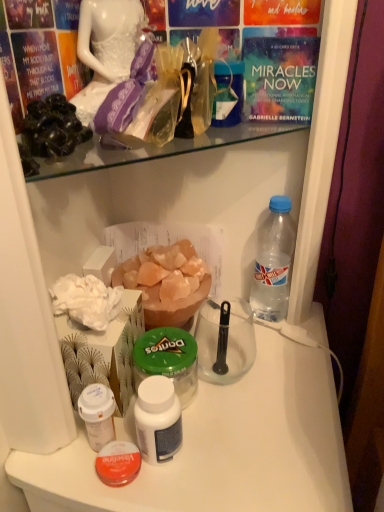
Question: From the image's perspective, is white plastic cup at lower left, arranged as the 4th bottle when viewed from the right, on black matte rock at upper left?

Choices:
 (A) no
 (B) yes

Answer: (A)

Question: Would you say white plastic cup at lower left, the first bottle when ordered from left to right, contains black matte rock at upper left?

Choices:
 (A) yes
 (B) no

Answer: (B)

Question: Is white plastic cup at lower left, arranged as the 4th bottle when viewed from the right, behind black matte rock at upper left?

Choices:
 (A) yes
 (B) no

Answer: (A)

Question: Is the depth of white plastic cup at lower left, arranged as the 4th bottle when viewed from the right, less than that of black matte rock at upper left?

Choices:
 (A) yes
 (B) no

Answer: (B)

Question: Could you tell me if white plastic cup at lower left, the first bottle when ordered from left to right, is turned towards black matte rock at upper left?

Choices:
 (A) yes
 (B) no

Answer: (B)

Question: Is white plastic cup at lower left, the first bottle when ordered from left to right, far away from black matte rock at upper left?

Choices:
 (A) yes
 (B) no

Answer: (B)

Question: Is clear plastic bottle at right, the first bottle when ordered from right to left, at the back of white plastic bottle at center, the 3th bottle positioned from the right?

Choices:
 (A) no
 (B) yes

Answer: (A)

Question: From a real-world perspective, does white plastic bottle at center, the 3th bottle positioned from the right, stand above clear plastic bottle at right, the first bottle when ordered from right to left?

Choices:
 (A) no
 (B) yes

Answer: (A)

Question: Is white plastic bottle at center, which is the second bottle from left to right, completely or partially outside of clear plastic bottle at right, which ranks as the 4th bottle in left-to-right order?

Choices:
 (A) yes
 (B) no

Answer: (A)

Question: Is white plastic bottle at center, which is the second bottle from left to right, in contact with clear plastic bottle at right, which ranks as the 4th bottle in left-to-right order?

Choices:
 (A) yes
 (B) no

Answer: (B)

Question: Considering the relative sizes of white plastic bottle at center, which is the second bottle from left to right, and clear plastic bottle at right, the first bottle when ordered from right to left, in the image provided, is white plastic bottle at center, which is the second bottle from left to right, thinner than clear plastic bottle at right, the first bottle when ordered from right to left,?

Choices:
 (A) yes
 (B) no

Answer: (A)

Question: Considering the relative sizes of white plastic bottle at center, the 3th bottle positioned from the right, and clear plastic bottle at right, the first bottle when ordered from right to left, in the image provided, is white plastic bottle at center, the 3th bottle positioned from the right, smaller than clear plastic bottle at right, the first bottle when ordered from right to left,?

Choices:
 (A) no
 (B) yes

Answer: (B)

Question: Does clear plastic bottle at right, the first bottle when ordered from right to left, appear on the left side of black matte rock at upper left?

Choices:
 (A) yes
 (B) no

Answer: (B)